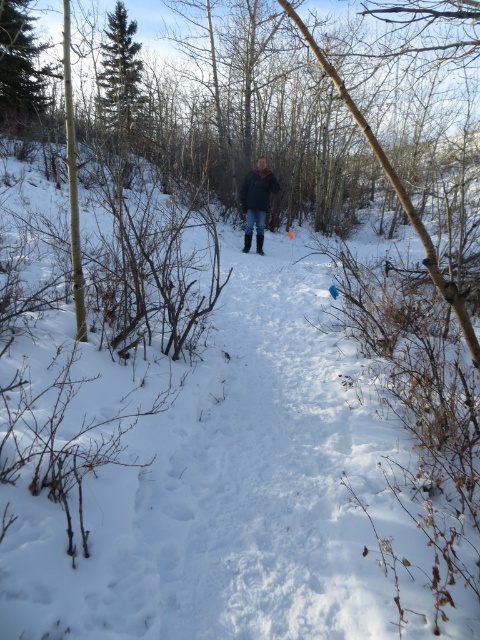
You are planning to take a photo of the dark blue jacket at center and the green leafy tree at upper left. Which object should you focus on first if you want to capture both in the same frame without moving the camera?

The green leafy tree at upper left is taller than the dark blue jacket at center, so you should focus on the tree first to ensure both are in frame.

You are standing in the snowy forest and see a green leafy tree at upper left. Where exactly is it located in the image?

The green leafy tree at upper left is located at point (21, 65).

You are a hiker lost in the snowy forest and see the green leafy tree at upper left and the dark blue jacket at center. Which object is bigger in size?

The green leafy tree at upper left is larger in size than the dark blue jacket at center.